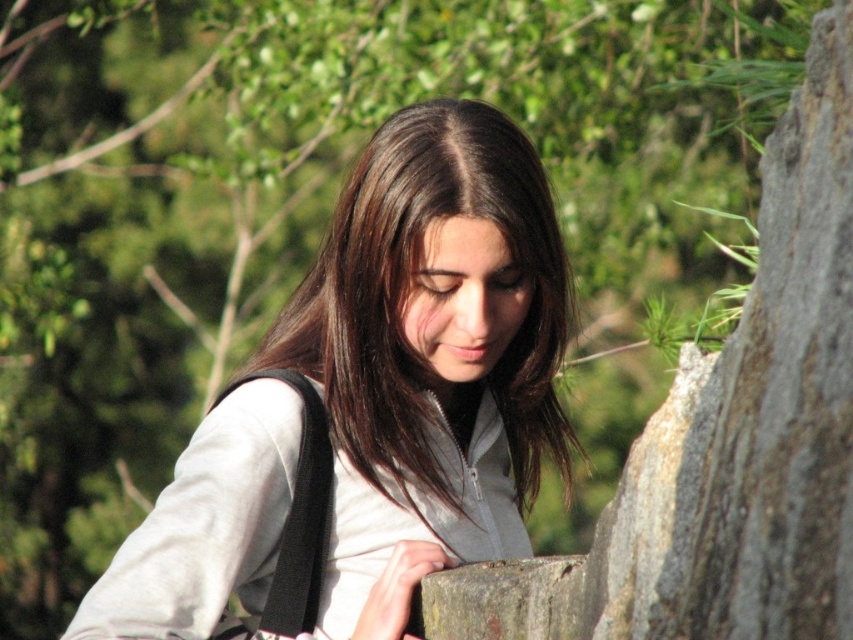
You are a hiker who just arrived at a rocky trail. You see the gray rough stone at center and the black fabric shoulder bag at lower left. Which object is positioned higher from the ground?

The gray rough stone at center is above the black fabric shoulder bag at lower left, so the gray rough stone at center is higher from the ground.

You are a hiker who needs to decide whether to wear the white matte jacket at center or leave it in your backpack. Considering the size of the jacket and the gray rough stone at center you might need to climb, which item would you choose to carry?

The white matte jacket at center is larger than the gray rough stone at center, so it would be more practical to leave the jacket in the backpack to save space and carry the smaller gray rough stone at center if needed for climbing.

You are a hiker who wants to place your black fabric shoulder bag at lower left on the gray rough stone at center. Based on the size of the objects, will the bag fit comfortably on the stone?

The gray rough stone at center has a larger size compared to black fabric shoulder bag at lower left, so the bag will fit comfortably on the stone.